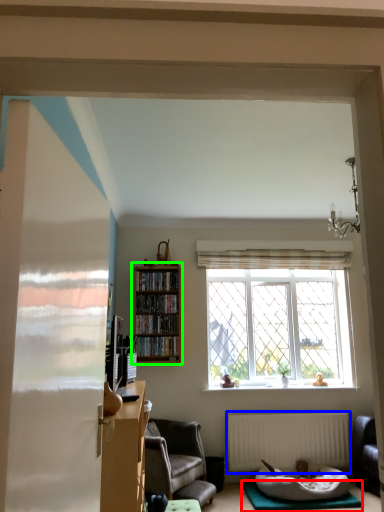
Question: Which object is the farthest from yoga mat (highlighted by a red box)? Choose among these: radiator (highlighted by a blue box) or bookcase (highlighted by a green box).

Choices:
 (A) radiator
 (B) bookcase

Answer: (B)